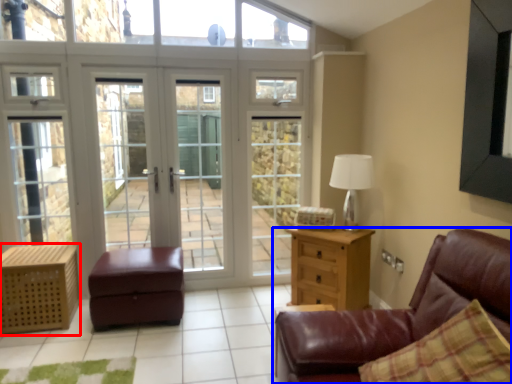
Question: Which object is closer to the camera taking this photo, nightstand (highlighted by a red box) or studio couch (highlighted by a blue box)?

Choices:
 (A) nightstand
 (B) studio couch

Answer: (B)